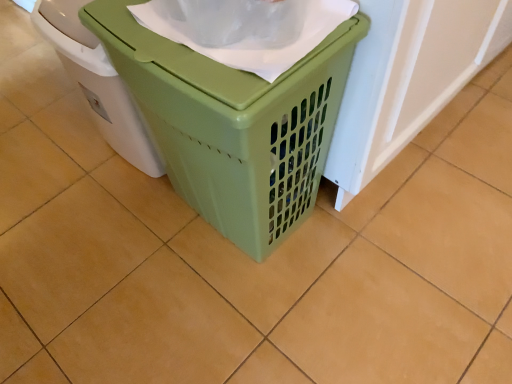
Question: Considering the relative sizes of green plastic laundry basket at center, positioned as the 2th waste container in left-to-right order, and green plastic laundry basket at center, arranged as the first waste container when viewed from the left, in the image provided, is green plastic laundry basket at center, positioned as the 2th waste container in left-to-right order, taller than green plastic laundry basket at center, arranged as the first waste container when viewed from the left,?

Choices:
 (A) no
 (B) yes

Answer: (B)

Question: Can you confirm if green plastic laundry basket at center, acting as the first waste container starting from the right, is bigger than green plastic laundry basket at center, arranged as the first waste container when viewed from the left?

Choices:
 (A) yes
 (B) no

Answer: (A)

Question: From the image's perspective, is green plastic laundry basket at center, positioned as the 2th waste container in left-to-right order, under green plastic laundry basket at center, arranged as the first waste container when viewed from the left?

Choices:
 (A) no
 (B) yes

Answer: (B)

Question: Does green plastic laundry basket at center, positioned as the 2th waste container in left-to-right order, appear on the left side of green plastic laundry basket at center, arranged as the first waste container when viewed from the left?

Choices:
 (A) no
 (B) yes

Answer: (A)

Question: Is green plastic laundry basket at center, positioned as the 2th waste container in left-to-right order, positioned behind green plastic laundry basket at center, arranged as the first waste container when viewed from the left?

Choices:
 (A) no
 (B) yes

Answer: (A)

Question: Is green plastic laundry basket at center, acting as the first waste container starting from the right, positioned far away from green plastic laundry basket at center, the second waste container from the right?

Choices:
 (A) no
 (B) yes

Answer: (A)

Question: Can you see green plastic laundry basket at center, arranged as the first waste container when viewed from the left, touching green plastic laundry basket at center, acting as the first waste container starting from the right?

Choices:
 (A) yes
 (B) no

Answer: (B)

Question: Would you consider green plastic laundry basket at center, the second waste container from the right, to be distant from green plastic laundry basket at center, acting as the first waste container starting from the right?

Choices:
 (A) no
 (B) yes

Answer: (A)

Question: Is green plastic laundry basket at center, acting as the first waste container starting from the right, completely or partially inside green plastic laundry basket at center, arranged as the first waste container when viewed from the left?

Choices:
 (A) no
 (B) yes

Answer: (A)

Question: Can you confirm if green plastic laundry basket at center, arranged as the first waste container when viewed from the left, is shorter than green plastic laundry basket at center, acting as the first waste container starting from the right?

Choices:
 (A) yes
 (B) no

Answer: (A)

Question: Can you confirm if green plastic laundry basket at center, the second waste container from the right, is wider than green plastic laundry basket at center, acting as the first waste container starting from the right?

Choices:
 (A) no
 (B) yes

Answer: (A)

Question: Can you confirm if green plastic laundry basket at center, the second waste container from the right, is smaller than green plastic laundry basket at center, positioned as the 2th waste container in left-to-right order?

Choices:
 (A) no
 (B) yes

Answer: (B)

Question: Looking at their shapes, would you say green plastic laundry basket at center, the second waste container from the right, is wider or thinner than green plastic laundry basket at center, acting as the first waste container starting from the right?

Choices:
 (A) thin
 (B) wide

Answer: (A)